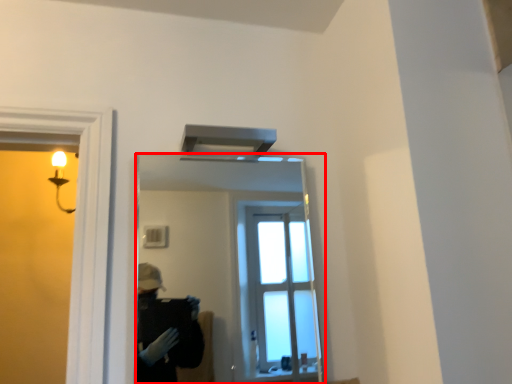
Question: From the image's perspective, what is the correct spatial relationship of mirror (annotated by the red box) in relation to exhaust hood?

Choices:
 (A) above
 (B) below

Answer: (B)